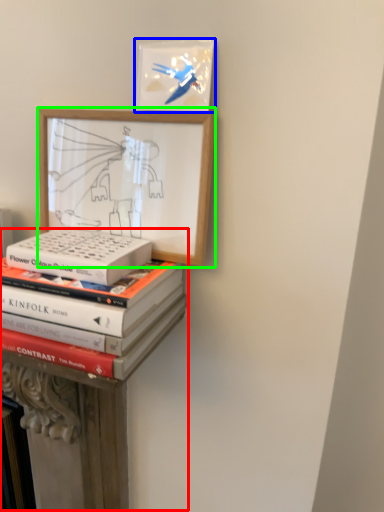
Question: Which object is the farthest from bookshelf (highlighted by a red box)? Choose among these: picture frame (highlighted by a blue box) or picture frame (highlighted by a green box).

Choices:
 (A) picture frame
 (B) picture frame

Answer: (A)